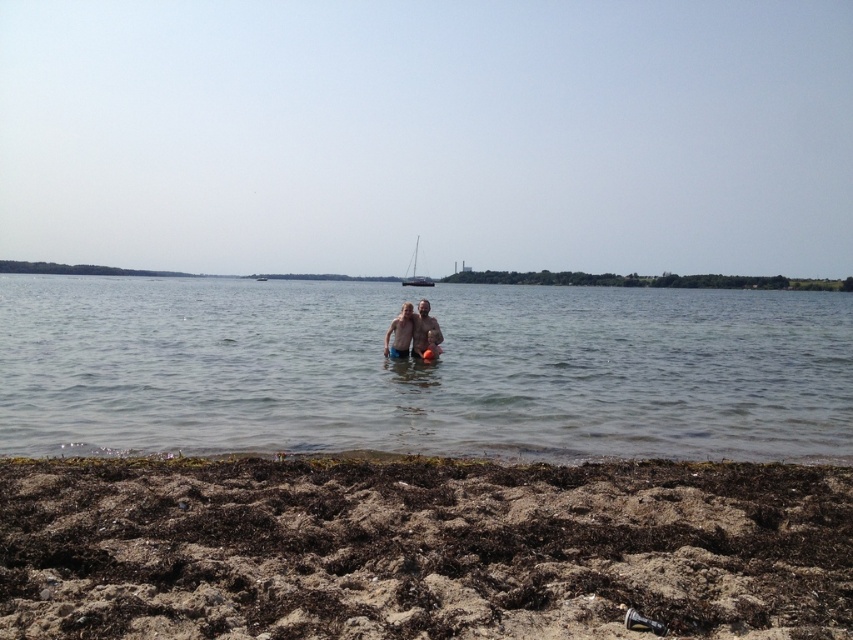
You are a photographer trying to capture the white matte sailboat at center and the smooth skin at center in the same frame. Based on their positions, which object would appear closer to the left side of your photo?

The smooth skin at center is to the right of the white matte sailboat at center, so the white matte sailboat at center would appear closer to the left side of the photo.

You are a photographer planning to take a portrait of the smooth skin couple at center. You want to ensure they are positioned in an area with minimal background distractions. Based on the scene description, is the location at point (412,332) suitable for this purpose?

The location at point (412,332) is suitable for a portrait of the smooth skin couple at center because the background features a distant sailboat with its mast clearly visible, which provides a simple and non distracting backdrop.

You are a photographer aiming to capture both the smooth skin at center and the white matte sailboat at center in the same frame. Based on their positions, which one would appear larger in your photo?

The smooth skin at center would appear larger in the photo because it is closer to the viewer than the white matte sailboat at center.